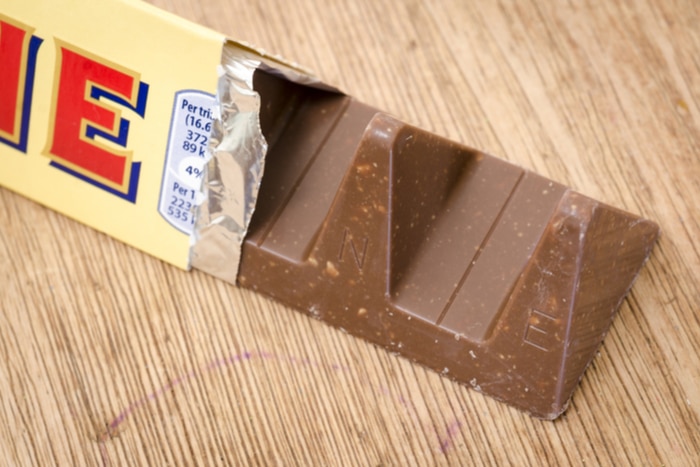
What are the coordinates of `aluminum foil cover` in the screenshot? It's located at (248, 143).